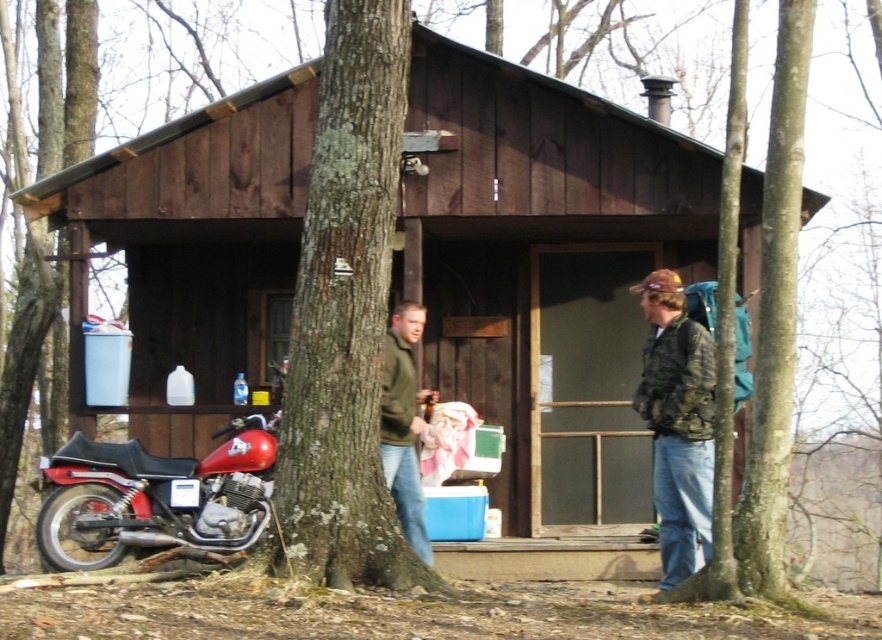
Who is more distant from viewer, [370,257] or [136,541]?

Point [136,541]

Based on the photo, who is positioned more to the right, smooth bark tree at center or shiny red motorcycle at lower left?

From the viewer's perspective, smooth bark tree at center appears more on the right side.

Is point (281, 566) farther from viewer compared to point (230, 468)?

That is False.

The image size is (882, 640). In order to click on smooth bark tree at center in this screenshot , I will do `click(345, 316)`.

Does smooth bark tree at center lie in front of camouflage jacket at right?

Yes, smooth bark tree at center is in front of camouflage jacket at right.

Is point (281, 502) positioned behind point (705, 532)?

No, it is not.

Where is `smooth bark tree at center`? The image size is (882, 640). smooth bark tree at center is located at coordinates (345, 316).

At what (x,y) coordinates should I click in order to perform the action: click on shiny red motorcycle at lower left. Please return your answer as a coordinate pair (x, y). Looking at the image, I should click on (155, 497).

Find the location of a particular element. This screenshot has width=882, height=640. shiny red motorcycle at lower left is located at coordinates (155, 497).